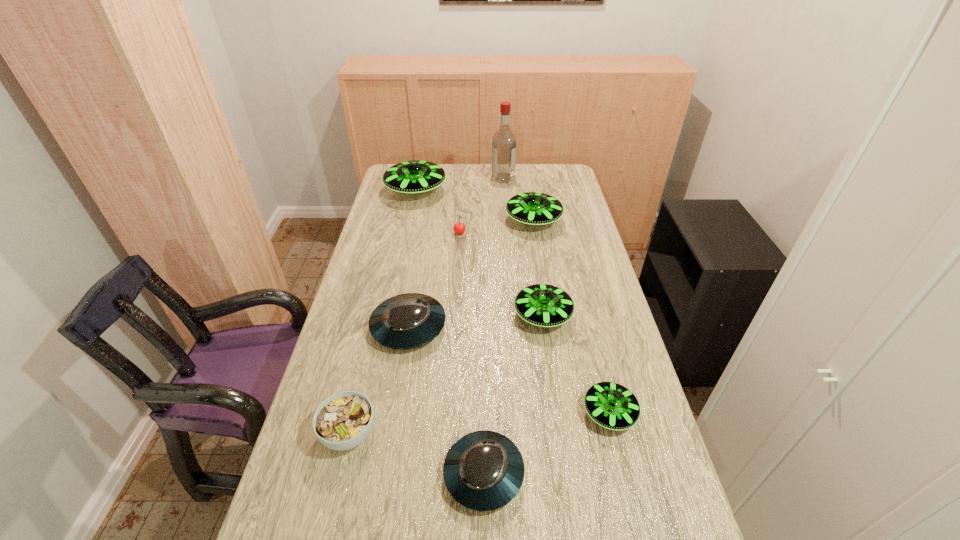
At what (x,y) coordinates should I click in order to perform the action: click on vacant area that lies between the second biggest green saucer and the second nearest green saucer. Please return your answer as a coordinate pair (x, y). Looking at the image, I should click on (539, 268).

Where is `blank region between the second tallest saucer and the red cherry`? The image size is (960, 540). blank region between the second tallest saucer and the red cherry is located at coordinates (496, 228).

The width and height of the screenshot is (960, 540). In order to click on unoccupied area between the second tallest object and the smallest green saucer in this screenshot , I will do `click(513, 302)`.

Image resolution: width=960 pixels, height=540 pixels. Find the location of `free area in between the right gray saucer and the soup bowl`. free area in between the right gray saucer and the soup bowl is located at coordinates (417, 454).

Identify the location of vacant area that lies between the second biggest green saucer and the bigger gray saucer. The height and width of the screenshot is (540, 960). (471, 274).

In order to click on vacant space that's between the red cherry and the eighth shortest object in this screenshot , I will do (x=438, y=213).

Locate which object is the sixth closest to the red cherry. Please provide its 2D coordinates. Your answer should be formatted as a tuple, i.e. [(x, y)], where the tuple contains the x and y coordinates of a point satisfying the conditions above.

[(611, 405)]

Identify which object is located as the nearest to the third smallest green saucer. Please provide its 2D coordinates. Your answer should be formatted as a tuple, i.e. [(x, y)], where the tuple contains the x and y coordinates of a point satisfying the conditions above.

[(459, 228)]

Choose which saucer is the fourth nearest neighbor to the third smallest green saucer. Please provide its 2D coordinates. Your answer should be formatted as a tuple, i.e. [(x, y)], where the tuple contains the x and y coordinates of a point satisfying the conditions above.

[(611, 405)]

Find the location of a particular element. This screenshot has height=540, width=960. the closest saucer to the tallest saucer is located at coordinates (531, 208).